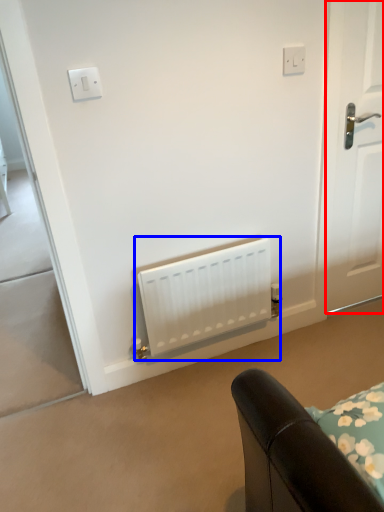
Question: Among these objects, which one is farthest to the camera, door (highlighted by a red box) or radiator (highlighted by a blue box)?

Choices:
 (A) door
 (B) radiator

Answer: (B)